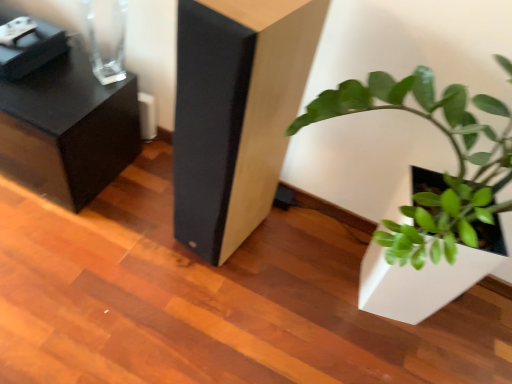
Where is `black textured side table at upper left, which appears as the first furniture when viewed from the left`? The width and height of the screenshot is (512, 384). black textured side table at upper left, which appears as the first furniture when viewed from the left is located at coordinates (68, 130).

What do you see at coordinates (68, 130) in the screenshot? This screenshot has height=384, width=512. I see `black textured side table at upper left, which appears as the first furniture when viewed from the left` at bounding box center [68, 130].

Where is `black textured side table at upper left, the second furniture from the right`? The image size is (512, 384). black textured side table at upper left, the second furniture from the right is located at coordinates (68, 130).

Is black textured side table at upper left, the second furniture from the right, positioned before green matte plant at lower right?

No, black textured side table at upper left, the second furniture from the right, is behind green matte plant at lower right.

Is point (99, 105) less distant than point (465, 262)?

That is False.

Is black textured side table at upper left, the second furniture from the right, with green matte plant at lower right?

No, black textured side table at upper left, the second furniture from the right, is not in contact with green matte plant at lower right.

From a real-world perspective, is green matte plant at lower right physically located above or below black textured side table at upper left, which appears as the first furniture when viewed from the left?

From a real-world perspective, green matte plant at lower right is physically above black textured side table at upper left, which appears as the first furniture when viewed from the left.

From the image's perspective, is green matte plant at lower right located beneath black textured side table at upper left, the second furniture from the right?

Yes, from the image's perspective, green matte plant at lower right is below black textured side table at upper left, the second furniture from the right.

From the picture: Is green matte plant at lower right facing away from black textured side table at upper left, the second furniture from the right?

No, green matte plant at lower right is not facing away from black textured side table at upper left, the second furniture from the right.

In terms of height, does green matte plant at lower right look taller or shorter compared to black textured side table at upper left, the second furniture from the right?

Clearly, green matte plant at lower right is taller compared to black textured side table at upper left, the second furniture from the right.

Does matte black speaker at center, marked as the 1th furniture in a right-to-left arrangement, have a greater height compared to green matte plant at lower right?

In fact, matte black speaker at center, marked as the 1th furniture in a right-to-left arrangement, may be shorter than green matte plant at lower right.

Relative to green matte plant at lower right, is matte black speaker at center, placed as the second furniture when sorted from left to right, in front or behind?

Clearly, matte black speaker at center, placed as the second furniture when sorted from left to right, is behind green matte plant at lower right.

Is matte black speaker at center, placed as the second furniture when sorted from left to right, located outside green matte plant at lower right?

Yes, matte black speaker at center, placed as the second furniture when sorted from left to right, is not within green matte plant at lower right.

Between matte black speaker at center, marked as the 1th furniture in a right-to-left arrangement, and green matte plant at lower right, which one has larger width?

green matte plant at lower right is wider.

How different are the orientations of green matte plant at lower right and matte black speaker at center, marked as the 1th furniture in a right-to-left arrangement, in degrees?

The angle between the facing direction of green matte plant at lower right and the facing direction of matte black speaker at center, marked as the 1th furniture in a right-to-left arrangement, is 11.3 degrees.

Is point (482, 221) behind point (298, 6)?

Yes.

Which object is closer to the camera taking this photo, green matte plant at lower right or matte black speaker at center, marked as the 1th furniture in a right-to-left arrangement?

green matte plant at lower right is more forward.

From a real-world perspective, is green matte plant at lower right located higher than matte black speaker at center, placed as the second furniture when sorted from left to right?

Yes.

Is black textured side table at upper left, the second furniture from the right, a part of matte black speaker at center, placed as the second furniture when sorted from left to right?

That's incorrect, black textured side table at upper left, the second furniture from the right, is not inside matte black speaker at center, placed as the second furniture when sorted from left to right.

Based on their sizes in the image, would you say matte black speaker at center, marked as the 1th furniture in a right-to-left arrangement, is bigger or smaller than black textured side table at upper left, the second furniture from the right?

In the image, matte black speaker at center, marked as the 1th furniture in a right-to-left arrangement, appears to be smaller than black textured side table at upper left, the second furniture from the right.

Which is more to the right, matte black speaker at center, marked as the 1th furniture in a right-to-left arrangement, or black textured side table at upper left, which appears as the first furniture when viewed from the left?

From the viewer's perspective, matte black speaker at center, marked as the 1th furniture in a right-to-left arrangement, appears more on the right side.

Is matte black speaker at center, marked as the 1th furniture in a right-to-left arrangement, taller than black textured side table at upper left, which appears as the first furniture when viewed from the left?

Indeed, matte black speaker at center, marked as the 1th furniture in a right-to-left arrangement, has a greater height compared to black textured side table at upper left, which appears as the first furniture when viewed from the left.

From the image's perspective, which is above, black textured side table at upper left, which appears as the first furniture when viewed from the left, or matte black speaker at center, marked as the 1th furniture in a right-to-left arrangement?

black textured side table at upper left, which appears as the first furniture when viewed from the left, is shown above in the image.

Is black textured side table at upper left, which appears as the first furniture when viewed from the left, looking in the opposite direction of matte black speaker at center, placed as the second furniture when sorted from left to right?

No, black textured side table at upper left, which appears as the first furniture when viewed from the left, is not facing the opposite direction of matte black speaker at center, placed as the second furniture when sorted from left to right.

Consider the image. Can matte black speaker at center, placed as the second furniture when sorted from left to right, be found inside black textured side table at upper left, the second furniture from the right?

No, black textured side table at upper left, the second furniture from the right, does not contain matte black speaker at center, placed as the second furniture when sorted from left to right.

Can you confirm if black textured side table at upper left, the second furniture from the right, is taller than matte black speaker at center, marked as the 1th furniture in a right-to-left arrangement?

No.

The image size is (512, 384). I want to click on houseplant above the black textured side table at upper left, which appears as the first furniture when viewed from the left (from a real-world perspective), so click(429, 197).

The width and height of the screenshot is (512, 384). I want to click on houseplant located below the black textured side table at upper left, the second furniture from the right (from the image's perspective), so click(429, 197).

Looking at the image, which one is located closer to green matte plant at lower right, black textured side table at upper left, the second furniture from the right, or matte black speaker at center, marked as the 1th furniture in a right-to-left arrangement?

The object closer to green matte plant at lower right is matte black speaker at center, marked as the 1th furniture in a right-to-left arrangement.

Estimate the real-world distances between objects in this image. Which object is closer to matte black speaker at center, marked as the 1th furniture in a right-to-left arrangement, black textured side table at upper left, which appears as the first furniture when viewed from the left, or green matte plant at lower right?

green matte plant at lower right lies closer to matte black speaker at center, marked as the 1th furniture in a right-to-left arrangement, than the other object.

Based on their spatial positions, is green matte plant at lower right or black textured side table at upper left, which appears as the first furniture when viewed from the left, further from matte black speaker at center, marked as the 1th furniture in a right-to-left arrangement?

The object further to matte black speaker at center, marked as the 1th furniture in a right-to-left arrangement, is black textured side table at upper left, which appears as the first furniture when viewed from the left.

From the image, which object appears to be farther from black textured side table at upper left, the second furniture from the right, matte black speaker at center, marked as the 1th furniture in a right-to-left arrangement, or green matte plant at lower right?

Based on the image, green matte plant at lower right appears to be further to black textured side table at upper left, the second furniture from the right.

Looking at the image, which one is located closer to black textured side table at upper left, which appears as the first furniture when viewed from the left, green matte plant at lower right or matte black speaker at center, marked as the 1th furniture in a right-to-left arrangement?

matte black speaker at center, marked as the 1th furniture in a right-to-left arrangement, lies closer to black textured side table at upper left, which appears as the first furniture when viewed from the left, than the other object.

Looking at the image, which one is located further to green matte plant at lower right, matte black speaker at center, marked as the 1th furniture in a right-to-left arrangement, or black textured side table at upper left, the second furniture from the right?

Based on the image, black textured side table at upper left, the second furniture from the right, appears to be further to green matte plant at lower right.

Find the location of `furniture located between black textured side table at upper left, which appears as the first furniture when viewed from the left, and green matte plant at lower right in the left-right direction`. furniture located between black textured side table at upper left, which appears as the first furniture when viewed from the left, and green matte plant at lower right in the left-right direction is located at coordinates (234, 113).